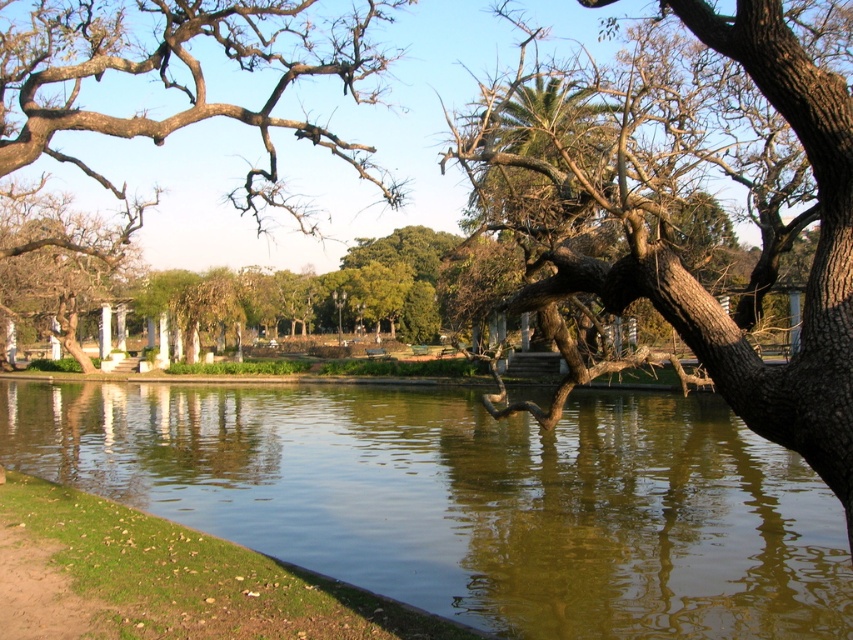
Question: Is brown rough tree at upper left further to camera compared to brown wood tree at left?

Choices:
 (A) yes
 (B) no

Answer: (B)

Question: Is brown textured bark at center below brown rough tree at upper left?

Choices:
 (A) no
 (B) yes

Answer: (B)

Question: Among these objects, which one is farthest from the camera?

Choices:
 (A) green reflective water at center
 (B) brown rough tree at upper left

Answer: (B)

Question: Which point is farther to the camera?

Choices:
 (A) brown rough tree at upper left
 (B) green reflective water at center
 (C) brown textured bark at center
 (D) brown wood tree at left

Answer: (D)

Question: Which object appears farthest from the camera in this image?

Choices:
 (A) green reflective water at center
 (B) brown rough tree at upper left
 (C) brown wood tree at left
 (D) brown textured bark at center

Answer: (C)

Question: Is the position of brown textured bark at center more distant than that of brown wood tree at left?

Choices:
 (A) no
 (B) yes

Answer: (A)